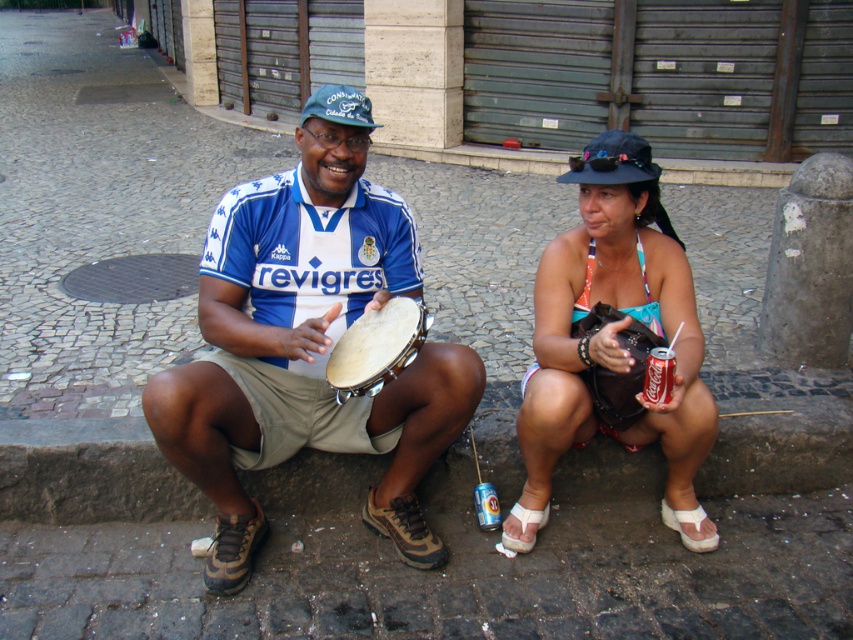
You are a photographer standing between the two people on the stone wall. You want to take a photo that includes both the light brown leather drum at center and the two people. Given that your camera has a maximum focus range of 2 meters, will you be able to capture both subjects in focus?

The two people are 2.11 meters apart, which exceeds the camera maximum focus range of 2 meters. Therefore, you cannot capture both subjects in focus.

You are a photographer trying to capture a closeup of the teal bikini top at center and light brown leather drum at center. Which object should you zoom in on to ensure both fit in the frame without cropping?

The light brown leather drum at center has a smaller width than the teal bikini top at center, so zooming in on the light brown leather drum at center will allow both objects to fit within the frame without cropping.

You are a street performer who needs to place your light brown leather drum at center and white fabric sandal at lower center on a 1.2 meter wide stage. Can both items fit side by side without overlapping?

The light brown leather drum at center might be wider than white fabric sandal at lower center, so there is a possibility that the drum alone could exceed the 1.2 meter width, making it uncertain if both can fit without overlapping.